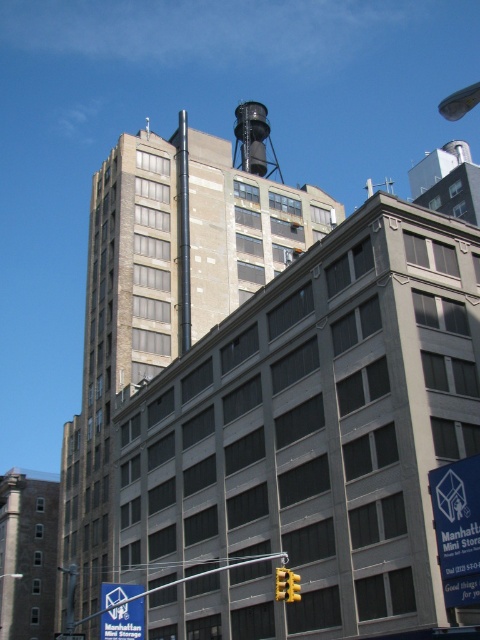
Question: Among these points, which one is farthest from the camera?

Choices:
 (A) (288, 582)
 (B) (39, 589)

Answer: (B)

Question: Based on their relative distances, which object is nearer to the brick tower at left?

Choices:
 (A) yellow plastic traffic light at lower center
 (B) yellow plastic traffic light at center

Answer: (A)

Question: Can you confirm if yellow plastic traffic light at lower center is thinner than yellow plastic traffic light at center?

Choices:
 (A) yes
 (B) no

Answer: (B)

Question: Does black matte water tower at upper center appear on the left side of yellow plastic traffic light at center?

Choices:
 (A) yes
 (B) no

Answer: (B)

Question: Which of the following is the farthest from the observer?

Choices:
 (A) (238, 140)
 (B) (132, 604)

Answer: (A)

Question: Does black matte water tower at upper center appear over blue plastic street sign at center?

Choices:
 (A) yes
 (B) no

Answer: (A)